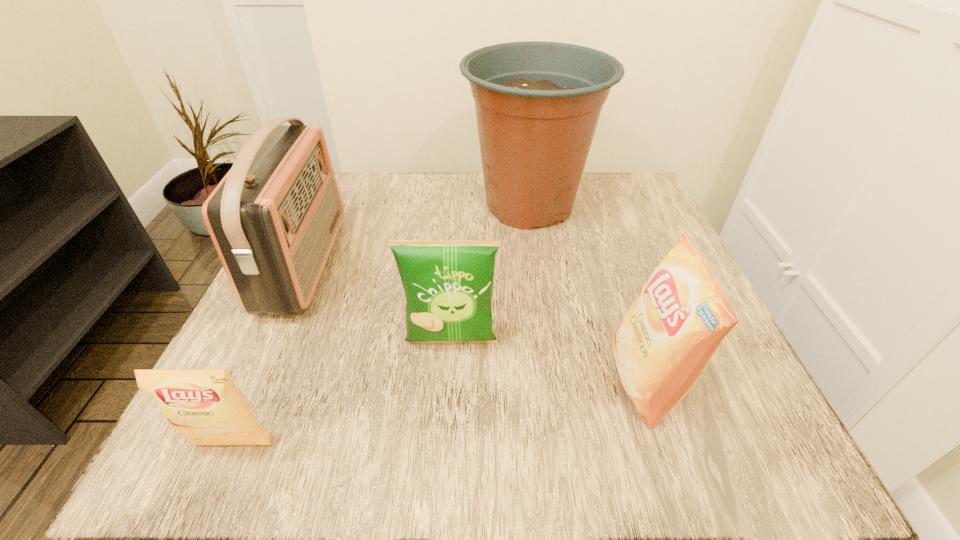
At what (x,y) coordinates should I click in order to perform the action: click on flowerpot. Please return your answer as a coordinate pair (x, y). Looking at the image, I should click on (537, 104).

This screenshot has width=960, height=540. Identify the location of the fourth shortest object. (273, 219).

Find the location of a particular element. This screenshot has width=960, height=540. the rightmost crisp (potato chip) is located at coordinates (664, 342).

Where is `the second crisp (potato chip) from right to left`? The image size is (960, 540). the second crisp (potato chip) from right to left is located at coordinates 448,284.

Find the location of a particular element. the nearest object is located at coordinates (206, 406).

Identify the location of the shortest crisp (potato chip). This screenshot has height=540, width=960. (206, 406).

Locate an element on the screen. The height and width of the screenshot is (540, 960). vacant region located 0.050m on the right of the flowerpot is located at coordinates (616, 205).

Locate an element on the screen. The image size is (960, 540). vacant space located on the front-facing side of the radio receiver is located at coordinates (413, 264).

The height and width of the screenshot is (540, 960). I want to click on vacant space located 0.310m on the front-facing side of the rightmost crisp (potato chip), so click(x=405, y=381).

Image resolution: width=960 pixels, height=540 pixels. What are the coordinates of `vacant space located 0.070m on the front-facing side of the rightmost crisp (potato chip)` in the screenshot? It's located at (566, 381).